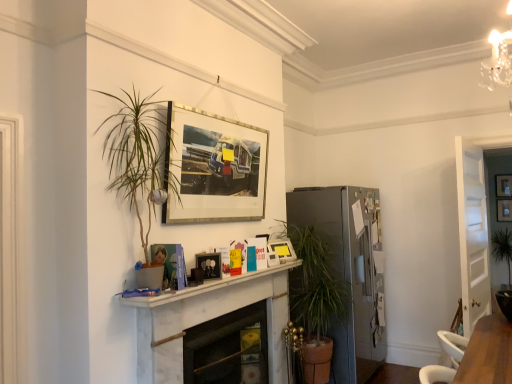
Question: From a real-world perspective, is white marble mantle at center located higher than wooden picture frame at upper center, the 2th picture frame from the back?

Choices:
 (A) no
 (B) yes

Answer: (A)

Question: Considering the relative sizes of white marble mantle at center and wooden picture frame at upper center, which is the fourth picture frame from front to back, in the image provided, is white marble mantle at center smaller than wooden picture frame at upper center, which is the fourth picture frame from front to back,?

Choices:
 (A) no
 (B) yes

Answer: (A)

Question: Is the position of white marble mantle at center more distant than that of wooden picture frame at upper center, the 1th picture frame viewed from the right?

Choices:
 (A) no
 (B) yes

Answer: (A)

Question: From the image's perspective, would you say white marble mantle at center is shown under wooden picture frame at upper center, the 1th picture frame viewed from the right?

Choices:
 (A) no
 (B) yes

Answer: (B)

Question: Considering the relative positions of white marble mantle at center and wooden picture frame at upper center, the 1th picture frame viewed from the right, in the image provided, is white marble mantle at center in front of wooden picture frame at upper center, the 1th picture frame viewed from the right,?

Choices:
 (A) yes
 (B) no

Answer: (A)

Question: In terms of size, does white plastic swivel chair at lower right appear bigger or smaller than green leafy plant at center?

Choices:
 (A) small
 (B) big

Answer: (A)

Question: Considering the positions of point tap(424, 379) and point tap(495, 236), is point tap(424, 379) closer or farther from the camera than point tap(495, 236)?

Choices:
 (A) farther
 (B) closer

Answer: (B)

Question: Based on their positions, is white plastic swivel chair at lower right located to the left or right of green leafy plant at center?

Choices:
 (A) left
 (B) right

Answer: (A)

Question: Relative to green leafy plant at center, is white plastic swivel chair at lower right in front or behind?

Choices:
 (A) front
 (B) behind

Answer: (A)

Question: Is matte black picture frame at center, acting as the 2th picture frame starting from the front, bigger or smaller than wooden picture frame at upper center, which is the fourth picture frame from front to back?

Choices:
 (A) big
 (B) small

Answer: (B)

Question: Choose the correct answer: Is matte black picture frame at center, acting as the 2th picture frame starting from the front, inside wooden picture frame at upper center, which is the fourth picture frame from front to back, or outside it?

Choices:
 (A) inside
 (B) outside

Answer: (B)

Question: Would you say matte black picture frame at center, placed as the 1th picture frame when sorted from left to right, is to the left or to the right of wooden picture frame at upper center, which is the fourth picture frame from front to back, in the picture?

Choices:
 (A) left
 (B) right

Answer: (A)

Question: Is matte black picture frame at center, placed as the 1th picture frame when sorted from left to right, in front of or behind wooden picture frame at upper center, which is the fourth picture frame from front to back, in the image?

Choices:
 (A) behind
 (B) front

Answer: (B)

Question: In the image, is white marble fireplace at center, which ranks as the second fireplace in back-to-front order, positioned in front of or behind satin silver refrigerator at center-right?

Choices:
 (A) behind
 (B) front

Answer: (B)

Question: Considering the positions of white marble fireplace at center, arranged as the first fireplace when viewed from the front, and satin silver refrigerator at center-right in the image, is white marble fireplace at center, arranged as the first fireplace when viewed from the front, wider or thinner than satin silver refrigerator at center-right?

Choices:
 (A) wide
 (B) thin

Answer: (B)